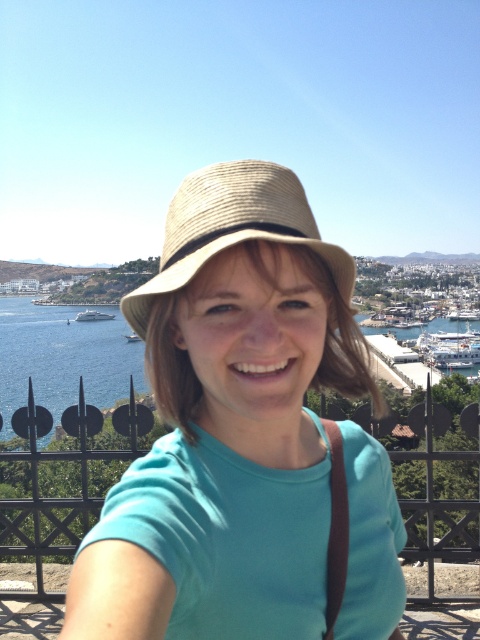
You are a photographer trying to capture the perfect shot of the person in the scene. Since the matte straw hat at center and the blue water at center are both at the center, which object is closer to the camera?

The matte straw hat at center is positioned over the blue water at center, meaning it is closer to the camera.

You are standing in the coastal area and see the natural straw hat at center and the blue water at center. Which object is nearer to you?

The natural straw hat at center is closer to the viewer than the blue water at center.